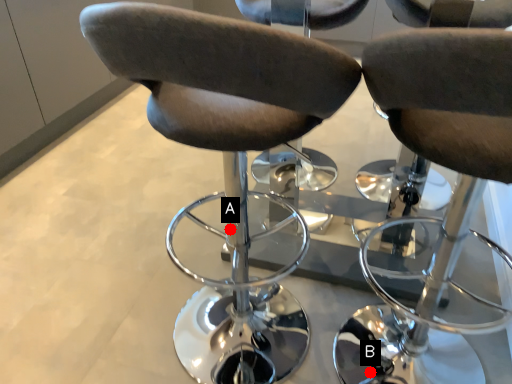
Question: Two points are circled on the image, labeled by A and B beside each circle. Which of the following is the closest to the observer?

Choices:
 (A) A is closer
 (B) B is closer

Answer: (A)